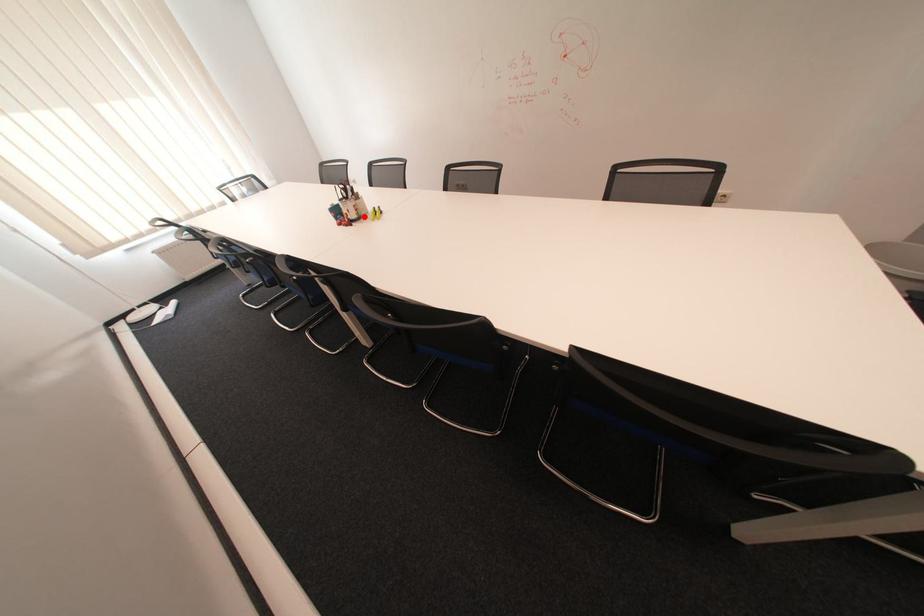
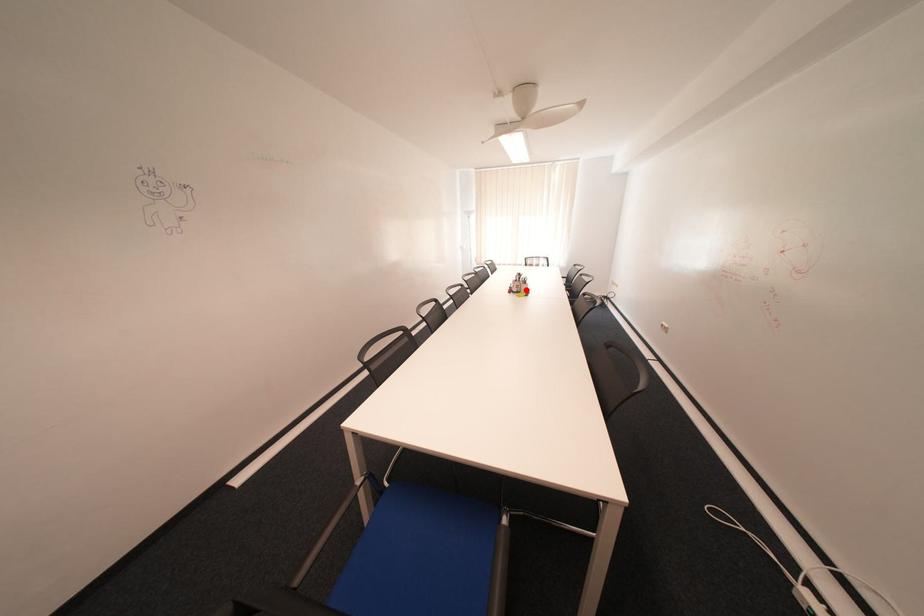
I am providing you with two images of the same scene from different viewpoints. A red point is marked on the first image and another point is marked on the second image. Are the points marked in image1 and image2 representing the same 3D position?

Yes